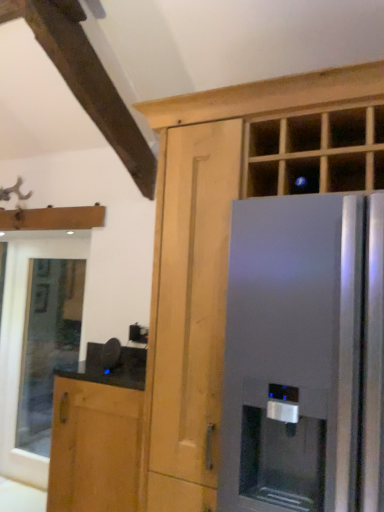
Locate an element on the screen. This screenshot has height=512, width=384. satin silver refrigerator at right is located at coordinates (304, 356).

Measure the distance between brown wood cabinet at lower left, which ranks as the 2th cabinetry in right-to-left order, and camera.

brown wood cabinet at lower left, which ranks as the 2th cabinetry in right-to-left order, is 1.85 meters from camera.

The width and height of the screenshot is (384, 512). What do you see at coordinates (94, 447) in the screenshot?
I see `brown wood cabinet at lower left, acting as the 1th cabinetry starting from the left` at bounding box center [94, 447].

Find the location of a particular element. The image size is (384, 512). matte wood cabinet at center, marked as the 2th cabinetry in a left-to-right arrangement is located at coordinates (215, 237).

Between satin silver refrigerator at right and clear glass window at lower left, which one appears on the right side from the viewer's perspective?

satin silver refrigerator at right.

Does satin silver refrigerator at right have a lesser width compared to clear glass window at lower left?

In fact, satin silver refrigerator at right might be wider than clear glass window at lower left.

Is the surface of satin silver refrigerator at right in direct contact with clear glass window at lower left?

No, satin silver refrigerator at right is not with clear glass window at lower left.

From the image's perspective, is satin silver refrigerator at right on top of clear glass window at lower left?

Correct, satin silver refrigerator at right appears higher than clear glass window at lower left in the image.

Is clear glass window at lower left taller or shorter than matte wood cabinet at center, marked as the 2th cabinetry in a left-to-right arrangement?

Considering their sizes, clear glass window at lower left has more height than matte wood cabinet at center, marked as the 2th cabinetry in a left-to-right arrangement.

From a real-world perspective, is clear glass window at lower left on top of matte wood cabinet at center, which is the first cabinetry from right to left?

No.

Consider the image. Which is more distant, (27, 353) or (130, 428)?

The point (27, 353) is farther from the camera.

Who is bigger, clear glass window at lower left or brown wood cabinet at lower left, acting as the 1th cabinetry starting from the left?

brown wood cabinet at lower left, acting as the 1th cabinetry starting from the left, is bigger.

Between clear glass window at lower left and brown wood cabinet at lower left, which ranks as the 2th cabinetry in right-to-left order, which one appears on the right side from the viewer's perspective?

Positioned to the right is brown wood cabinet at lower left, which ranks as the 2th cabinetry in right-to-left order.

Considering the positions of objects matte wood cabinet at center, which is the first cabinetry from right to left, and satin silver refrigerator at right in the image provided, who is more to the left, matte wood cabinet at center, which is the first cabinetry from right to left, or satin silver refrigerator at right?

matte wood cabinet at center, which is the first cabinetry from right to left, is more to the left.

Looking at this image, is matte wood cabinet at center, which is the first cabinetry from right to left, oriented away from satin silver refrigerator at right?

Yes, matte wood cabinet at center, which is the first cabinetry from right to left, is facing away from satin silver refrigerator at right.

Do you think matte wood cabinet at center, marked as the 2th cabinetry in a left-to-right arrangement, is within satin silver refrigerator at right, or outside of it?

matte wood cabinet at center, marked as the 2th cabinetry in a left-to-right arrangement, is inside satin silver refrigerator at right.

Which object is closer to the camera taking this photo, satin silver refrigerator at right or matte wood cabinet at center, marked as the 2th cabinetry in a left-to-right arrangement?

Positioned in front is satin silver refrigerator at right.

At what (x,y) coordinates should I click in order to perform the action: click on refrigerator located below the matte wood cabinet at center, marked as the 2th cabinetry in a left-to-right arrangement (from the image's perspective). Please return your answer as a coordinate pair (x, y). Image resolution: width=384 pixels, height=512 pixels. Looking at the image, I should click on (304, 356).

Considering the sizes of objects satin silver refrigerator at right and matte wood cabinet at center, marked as the 2th cabinetry in a left-to-right arrangement, in the image provided, who is smaller, satin silver refrigerator at right or matte wood cabinet at center, marked as the 2th cabinetry in a left-to-right arrangement,?

satin silver refrigerator at right is smaller.

Where is `cabinetry below the satin silver refrigerator at right (from the image's perspective)`? This screenshot has width=384, height=512. cabinetry below the satin silver refrigerator at right (from the image's perspective) is located at coordinates (94, 447).

Is point (120, 444) farther from camera compared to point (348, 228)?

Yes, it is.

Is brown wood cabinet at lower left, acting as the 1th cabinetry starting from the left, next to satin silver refrigerator at right?

No, brown wood cabinet at lower left, acting as the 1th cabinetry starting from the left, is not touching satin silver refrigerator at right.

Can you tell me how much brown wood cabinet at lower left, which ranks as the 2th cabinetry in right-to-left order, and satin silver refrigerator at right differ in facing direction?

brown wood cabinet at lower left, which ranks as the 2th cabinetry in right-to-left order, and satin silver refrigerator at right are facing 3.66 degrees away from each other.

Between brown wood cabinet at lower left, which ranks as the 2th cabinetry in right-to-left order, and matte wood cabinet at center, which is the first cabinetry from right to left, which one has less height?

With less height is brown wood cabinet at lower left, which ranks as the 2th cabinetry in right-to-left order.

The width and height of the screenshot is (384, 512). I want to click on cabinetry above the brown wood cabinet at lower left, which ranks as the 2th cabinetry in right-to-left order (from a real-world perspective), so click(215, 237).

Is brown wood cabinet at lower left, acting as the 1th cabinetry starting from the left, positioned before matte wood cabinet at center, which is the first cabinetry from right to left?

No, it is not.

Would you consider brown wood cabinet at lower left, which ranks as the 2th cabinetry in right-to-left order, to be distant from matte wood cabinet at center, marked as the 2th cabinetry in a left-to-right arrangement?

No, brown wood cabinet at lower left, which ranks as the 2th cabinetry in right-to-left order, is not far from matte wood cabinet at center, marked as the 2th cabinetry in a left-to-right arrangement.

You are a GUI agent. You are given a task and a screenshot of the screen. Output one action in this format:
    pyautogui.click(x=<x>, y=<y>)
    Task: Click on the refrigerator positioned vertically above the clear glass window at lower left (from a real-world perspective)
    
    Given the screenshot: What is the action you would take?
    pyautogui.click(x=304, y=356)

In order to click on window that is under the matte wood cabinet at center, which is the first cabinetry from right to left (from a real-world perspective) in this screenshot , I will do `click(47, 344)`.

Based on the photo, from the image, which object appears to be nearer to matte wood cabinet at center, marked as the 2th cabinetry in a left-to-right arrangement, clear glass window at lower left or brown wood cabinet at lower left, which ranks as the 2th cabinetry in right-to-left order?

brown wood cabinet at lower left, which ranks as the 2th cabinetry in right-to-left order.

From the image, which object appears to be farther from clear glass window at lower left, matte wood cabinet at center, which is the first cabinetry from right to left, or brown wood cabinet at lower left, acting as the 1th cabinetry starting from the left?

Among the two, matte wood cabinet at center, which is the first cabinetry from right to left, is located further to clear glass window at lower left.

From the image, which object appears to be farther from matte wood cabinet at center, which is the first cabinetry from right to left, satin silver refrigerator at right or brown wood cabinet at lower left, acting as the 1th cabinetry starting from the left?

brown wood cabinet at lower left, acting as the 1th cabinetry starting from the left, lies further to matte wood cabinet at center, which is the first cabinetry from right to left, than the other object.

Looking at the image, which one is located further to brown wood cabinet at lower left, acting as the 1th cabinetry starting from the left, satin silver refrigerator at right or matte wood cabinet at center, which is the first cabinetry from right to left?

satin silver refrigerator at right is further to brown wood cabinet at lower left, acting as the 1th cabinetry starting from the left.

In the scene shown: Considering their positions, is clear glass window at lower left positioned further to satin silver refrigerator at right than brown wood cabinet at lower left, which ranks as the 2th cabinetry in right-to-left order?

The object further to satin silver refrigerator at right is clear glass window at lower left.

Based on the photo, considering their positions, is matte wood cabinet at center, marked as the 2th cabinetry in a left-to-right arrangement, positioned closer to brown wood cabinet at lower left, acting as the 1th cabinetry starting from the left, than satin silver refrigerator at right?

Among the two, matte wood cabinet at center, marked as the 2th cabinetry in a left-to-right arrangement, is located nearer to brown wood cabinet at lower left, acting as the 1th cabinetry starting from the left.

Which object lies nearer to the anchor point clear glass window at lower left, matte wood cabinet at center, marked as the 2th cabinetry in a left-to-right arrangement, or satin silver refrigerator at right?

matte wood cabinet at center, marked as the 2th cabinetry in a left-to-right arrangement, is closer to clear glass window at lower left.

Looking at the image, which one is located further to satin silver refrigerator at right, brown wood cabinet at lower left, acting as the 1th cabinetry starting from the left, or clear glass window at lower left?

Among the two, clear glass window at lower left is located further to satin silver refrigerator at right.

The width and height of the screenshot is (384, 512). I want to click on cabinetry between matte wood cabinet at center, marked as the 2th cabinetry in a left-to-right arrangement, and clear glass window at lower left, along the z-axis, so point(94,447).

At what (x,y) coordinates should I click in order to perform the action: click on cabinetry between brown wood cabinet at lower left, which ranks as the 2th cabinetry in right-to-left order, and satin silver refrigerator at right. Please return your answer as a coordinate pair (x, y). Image resolution: width=384 pixels, height=512 pixels. Looking at the image, I should click on (215, 237).